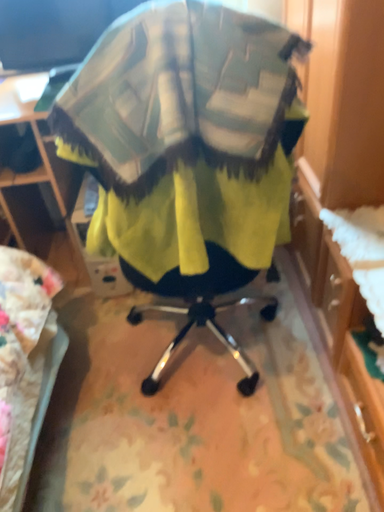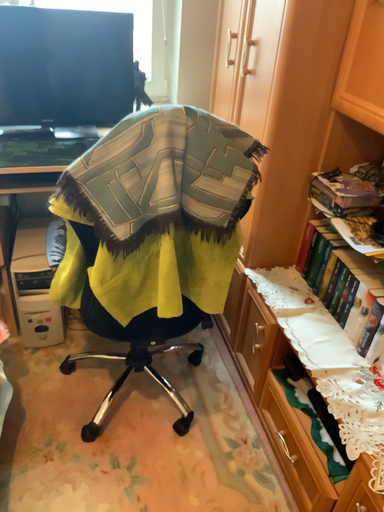
Question: Which way did the camera rotate in the video?

Choices:
 (A) rotated left
 (B) rotated right

Answer: (B)